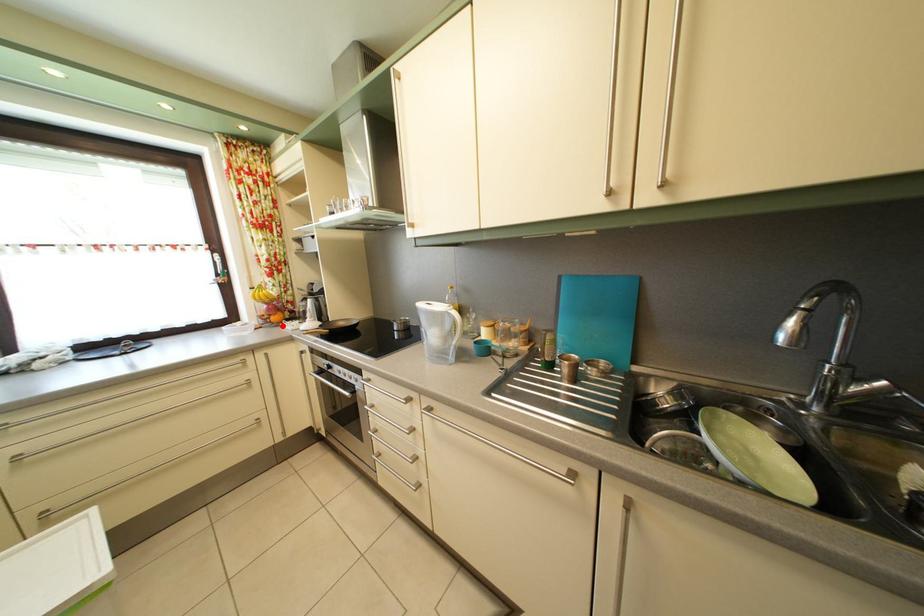
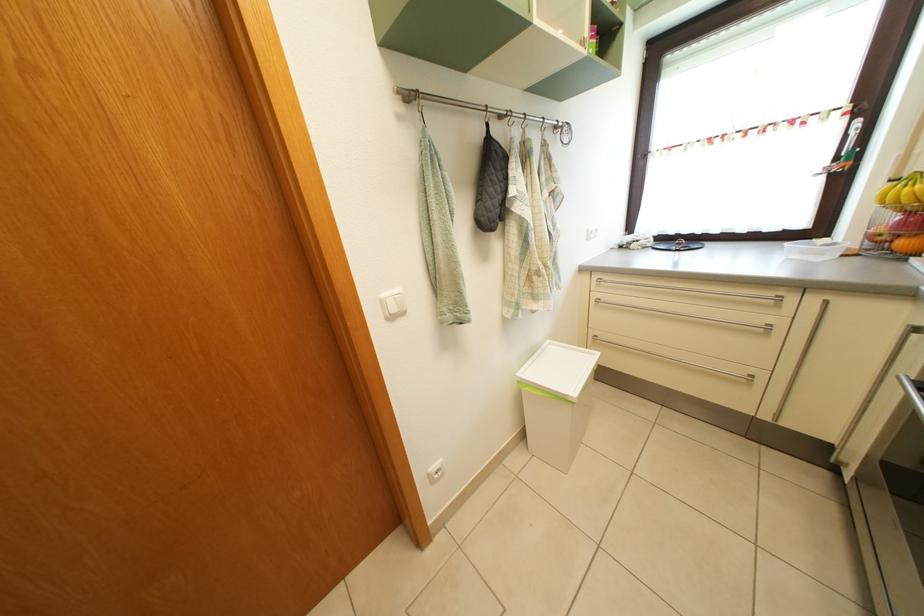
Question: I am providing you with two images of the same scene from different viewpoints. Image1 has a red point marked. In image2, the corresponding 3D location appears at what relative position? Reply with the corresponding letter.

Choices:
 (A) Closer
 (B) Farther

Answer: (B)